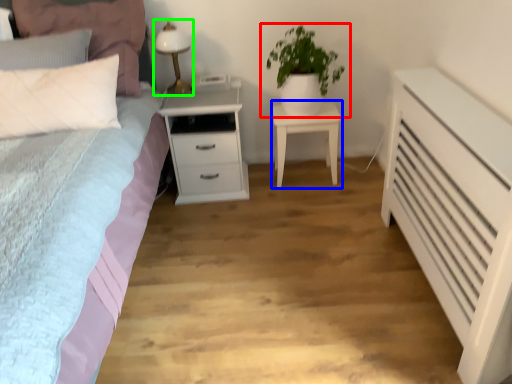
Question: Considering the real-world distances, which object is farthest from houseplant (highlighted by a red box)? nightstand (highlighted by a blue box) or bedside lamp (highlighted by a green box)?

Choices:
 (A) nightstand
 (B) bedside lamp

Answer: (B)